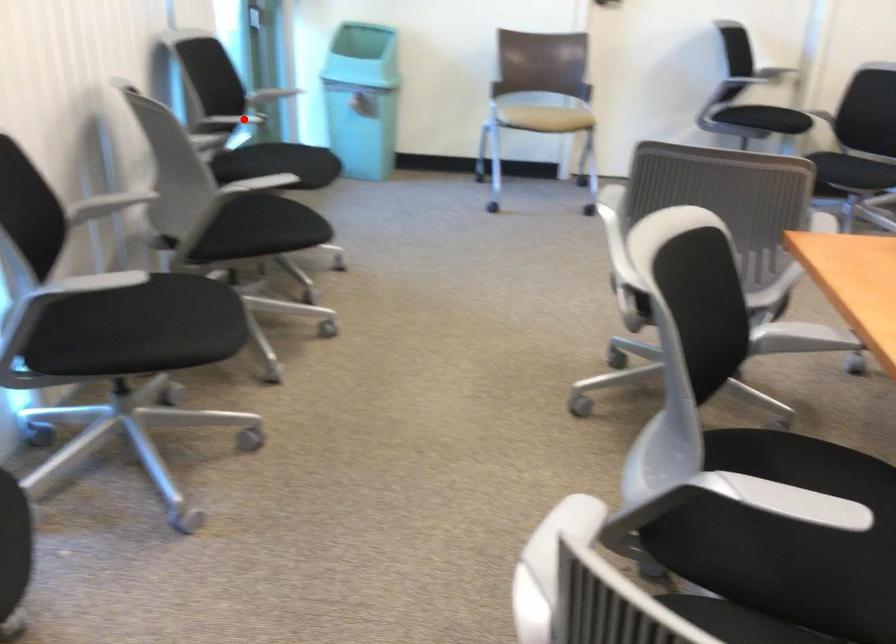
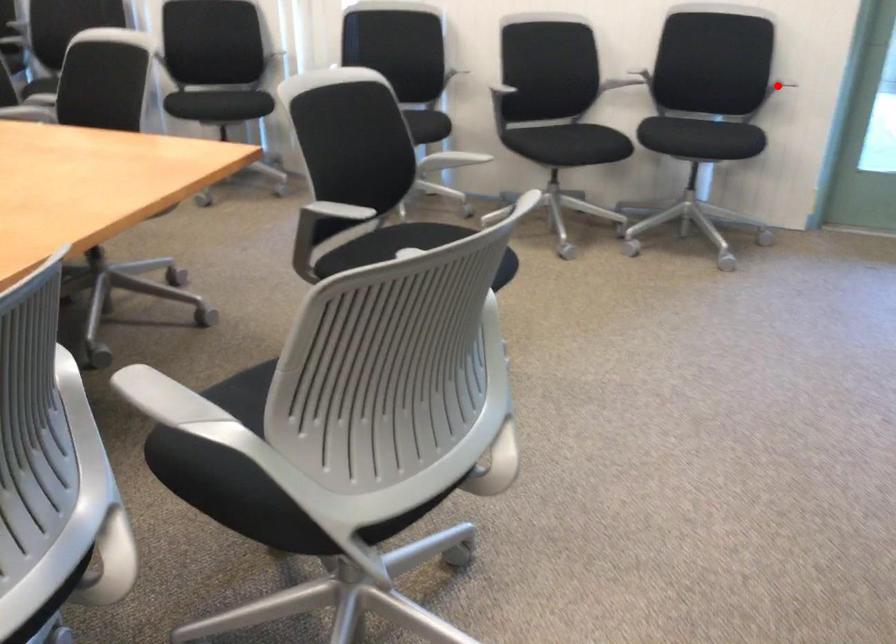
Looking at this image, I am providing you with two images of the same scene from different viewpoints. A red point is marked on the first image and another point is marked on the second image. Are the points marked in image1 and image2 representing the same 3D position?

Yes